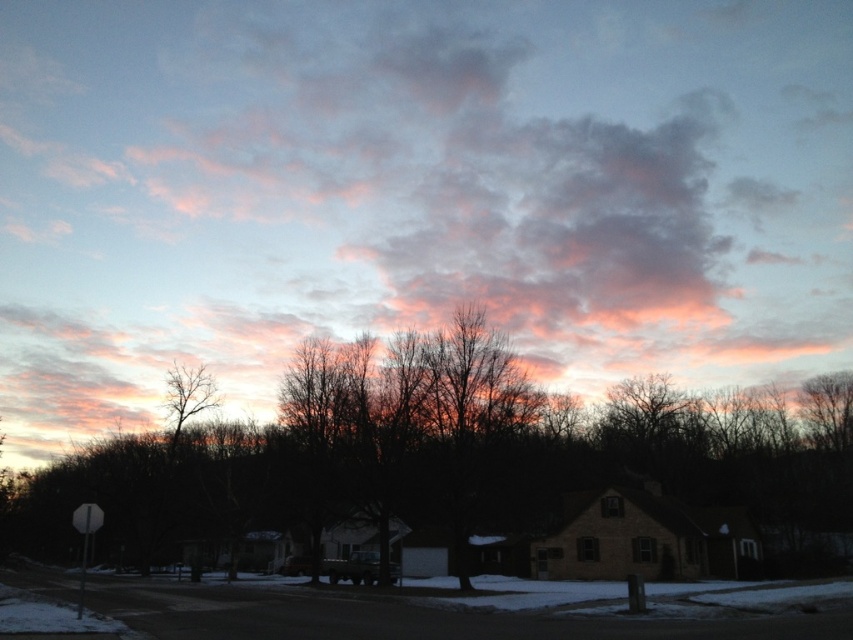
Based on the scene description and the objects provided, what is located at the coordinates point (438,452)?

The silhouette bare tree at center is located at point (438,452).

You are a drone operator who needs to fly a drone from the pink fluffy cloud at upper center to the bare branches at left. What is the approximate distance you need to cover?

The distance between the pink fluffy cloud at upper center and the bare branches at left is 67.79 meters, so you need to cover approximately 67.79 meters.

You are a bird flying over the suburban area. You see the pink fluffy cloud at upper center and the bare branches at left. Which object is higher in the sky?

The pink fluffy cloud at upper center is much taller than the bare branches at left, so it is higher in the sky.